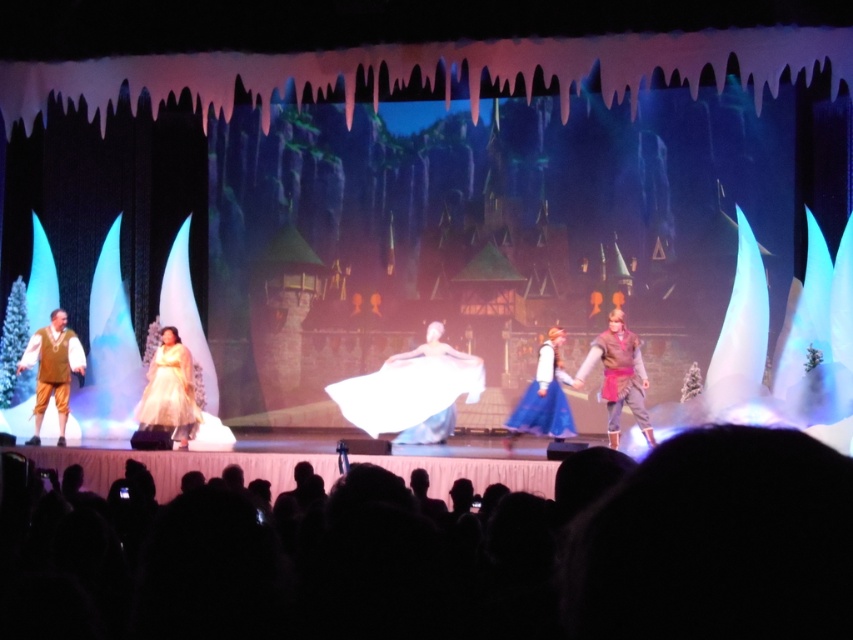
Question: Considering the relative positions of matte gold dress at center and brown leather vest at center in the image provided, where is matte gold dress at center located with respect to brown leather vest at center?

Choices:
 (A) left
 (B) right

Answer: (A)

Question: Can you confirm if white satin dress at center is positioned above matte gold dress at center?

Choices:
 (A) no
 (B) yes

Answer: (A)

Question: Which object is the farthest from the brown leather vest at center?

Choices:
 (A) white satin dress at center
 (B) matte gold dress at center

Answer: (B)

Question: Does white satin dress at center come in front of brown leather pants at left?

Choices:
 (A) yes
 (B) no

Answer: (B)

Question: Which object is closer to the camera taking this photo?

Choices:
 (A) matte gold dress at center
 (B) brown leather vest at center
 (C) brown leather pants at left

Answer: (A)

Question: Which point is closer to the camera?

Choices:
 (A) matte gold dress at center
 (B) white satin dress at center

Answer: (A)